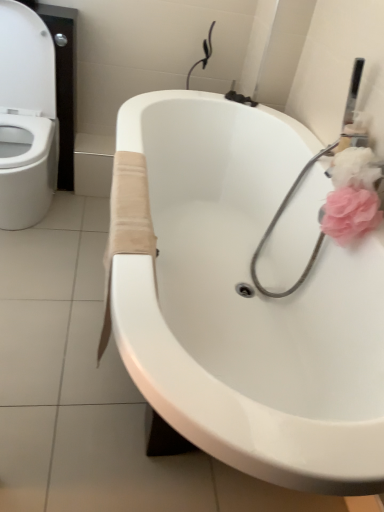
Question: Is the position of white glossy bathtub at center more distant than that of white glossy toilet at left?

Choices:
 (A) yes
 (B) no

Answer: (B)

Question: Does white glossy bathtub at center turn towards white glossy toilet at left?

Choices:
 (A) no
 (B) yes

Answer: (B)

Question: Can you confirm if white glossy bathtub at center is positioned to the right of white glossy toilet at left?

Choices:
 (A) yes
 (B) no

Answer: (A)

Question: Is white glossy bathtub at center oriented away from white glossy toilet at left?

Choices:
 (A) no
 (B) yes

Answer: (A)

Question: Is white glossy bathtub at center closer to the viewer compared to white glossy toilet at left?

Choices:
 (A) no
 (B) yes

Answer: (B)

Question: Would you say white glossy bathtub at center is inside or outside beige fabric towel at lower center?

Choices:
 (A) inside
 (B) outside

Answer: (B)

Question: From a real-world perspective, is white glossy bathtub at center above or below beige fabric towel at lower center?

Choices:
 (A) below
 (B) above

Answer: (A)

Question: Considering their positions, is white glossy bathtub at center located in front of or behind beige fabric towel at lower center?

Choices:
 (A) front
 (B) behind

Answer: (A)

Question: Is white glossy bathtub at center to the left or to the right of beige fabric towel at lower center in the image?

Choices:
 (A) left
 (B) right

Answer: (B)

Question: Do you think pink fluffy sponge at upper right, the second flower in the top-to-bottom sequence, is within white glossy toilet at left, or outside of it?

Choices:
 (A) inside
 (B) outside

Answer: (B)

Question: Considering the positions of pink fluffy sponge at upper right, acting as the first flower starting from the bottom, and white glossy toilet at left in the image, is pink fluffy sponge at upper right, acting as the first flower starting from the bottom, wider or thinner than white glossy toilet at left?

Choices:
 (A) thin
 (B) wide

Answer: (A)

Question: Does point (326, 220) appear closer or farther from the camera than point (11, 221)?

Choices:
 (A) closer
 (B) farther

Answer: (A)

Question: From the image's perspective, is pink fluffy sponge at upper right, acting as the first flower starting from the bottom, above or below white glossy toilet at left?

Choices:
 (A) above
 (B) below

Answer: (B)

Question: Is pink fluffy flower at upper right, which is the 1th flower in top-to-bottom order, inside the boundaries of pink fluffy sponge at upper right, acting as the first flower starting from the bottom, or outside?

Choices:
 (A) inside
 (B) outside

Answer: (B)

Question: Is point (337, 166) positioned closer to the camera than point (372, 224)?

Choices:
 (A) farther
 (B) closer

Answer: (A)